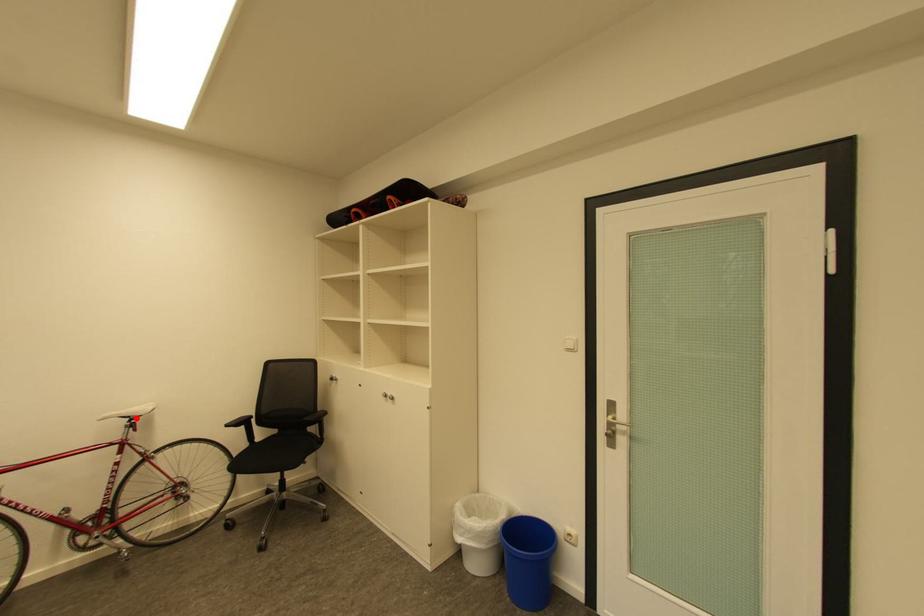
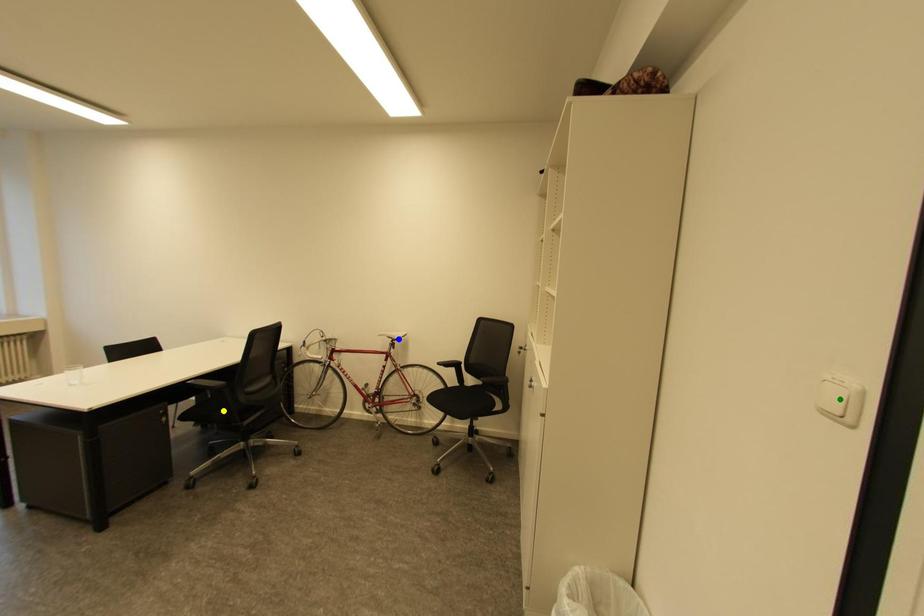
Question: I am providing you with two images of the same scene from different viewpoints. A red point is marked on the first image. You are given multiple points on the second image. Which point in image 2 represents the same 3d spot as the red point in image 1?

Choices:
 (A) green point
 (B) blue point
 (C) yellow point

Answer: (B)